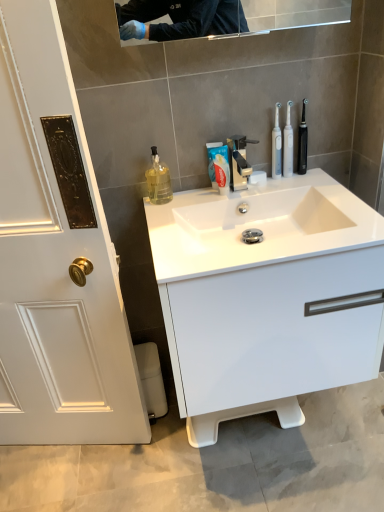
Image resolution: width=384 pixels, height=512 pixels. Identify the location of vacant area that lies between translucent glass mouthwash at left, which is the second mouthwash in right-to-left order, and polished chrome faucet at center. (198, 199).